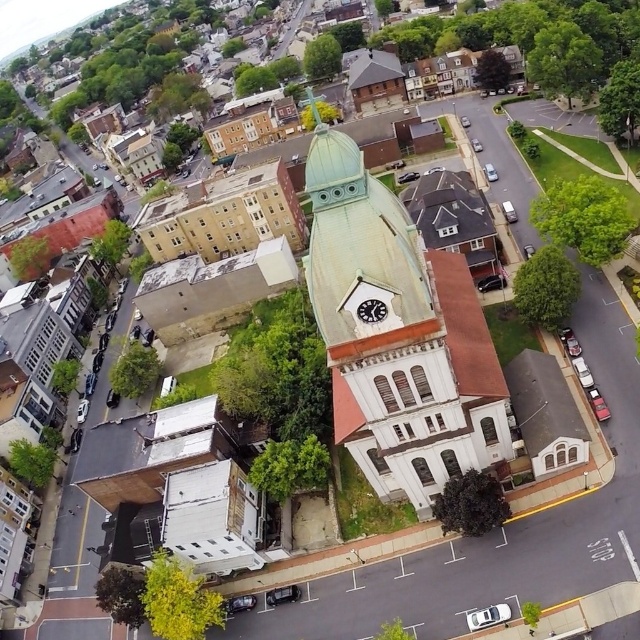
Does green copper dome at center come in front of light brown brick building at upper left?

Yes, it is in front of light brown brick building at upper left.

Is green copper dome at center above light brown brick building at upper left?

No, green copper dome at center is not above light brown brick building at upper left.

Does point (396, 470) come farther from viewer compared to point (266, 236)?

No.

At what (x,y) coordinates should I click in order to perform the action: click on green copper dome at center. Please return your answer as a coordinate pair (x, y). The height and width of the screenshot is (640, 640). Looking at the image, I should click on (397, 333).